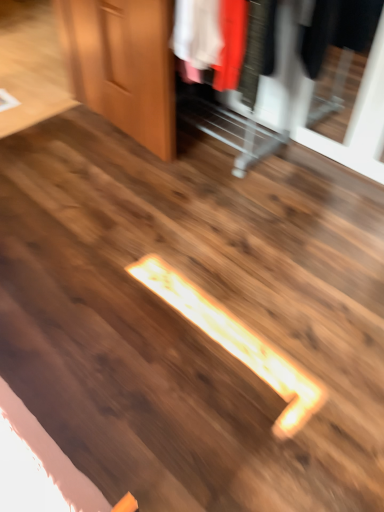
Find the location of a particular element. Image resolution: width=384 pixels, height=512 pixels. vacant space in front of wooden dresser at upper right is located at coordinates (194, 213).